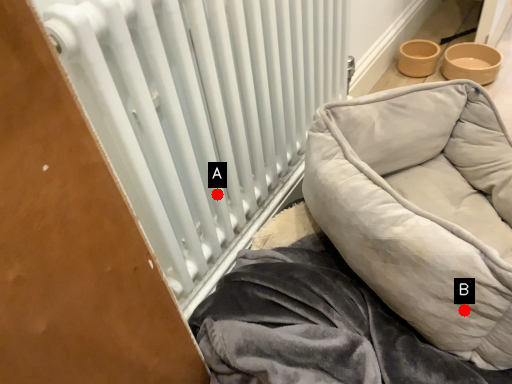
Question: Two points are circled on the image, labeled by A and B beside each circle. Which point is closer to the camera taking this photo?

Choices:
 (A) A is closer
 (B) B is closer

Answer: (B)